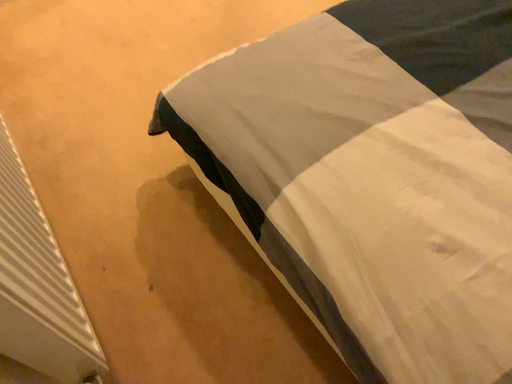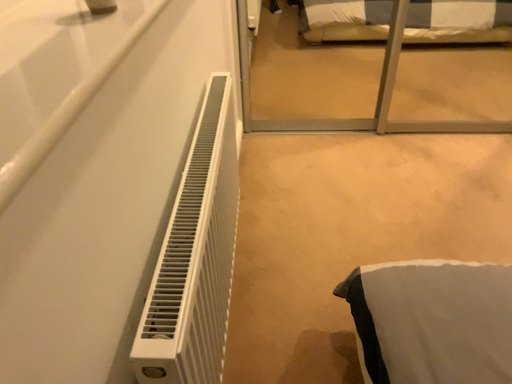
Question: Which way did the camera rotate in the video?

Choices:
 (A) rotated right
 (B) rotated left

Answer: (B)